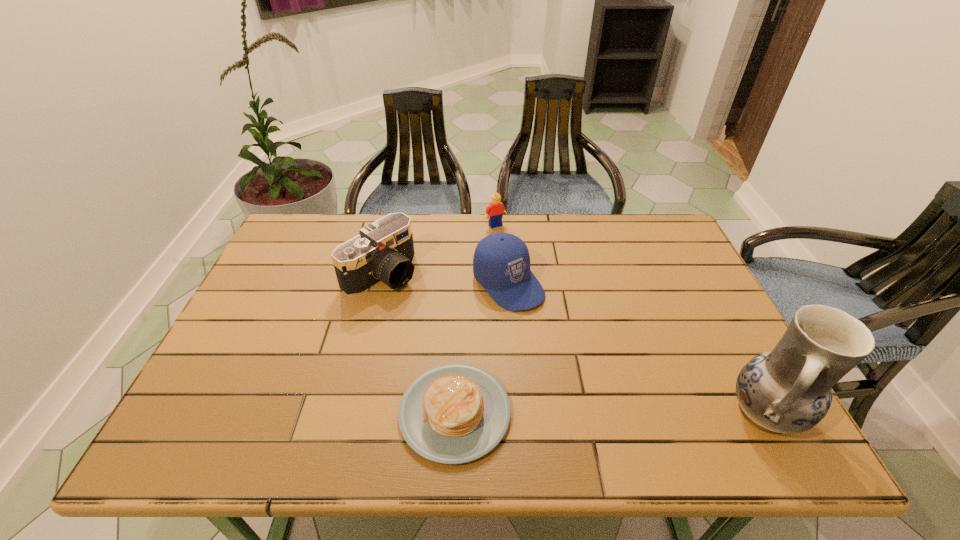
In the image, there is a desktop. At what (x,y) coordinates should I click in order to perform the action: click on free space at the far right corner. Please return your answer as a coordinate pair (x, y). Image resolution: width=960 pixels, height=540 pixels. Looking at the image, I should click on (670, 227).

You are a GUI agent. You are given a task and a screenshot of the screen. Output one action in this format:
    pyautogui.click(x=<x>, y=<y>)
    Task: Click on the vacant point located between the pottery and the farthest object
    
    Given the screenshot: What is the action you would take?
    pyautogui.click(x=631, y=320)

Identify the location of free space between the camera and the pancake. The image size is (960, 540). (x=419, y=342).

Where is `free space between the leftmost object and the pottery`? The width and height of the screenshot is (960, 540). free space between the leftmost object and the pottery is located at coordinates (574, 344).

Locate an element on the screen. The image size is (960, 540). free space between the pottery and the pancake is located at coordinates (611, 413).

At what (x,y) coordinates should I click in order to perform the action: click on free spot between the leftmost object and the Lego. Please return your answer as a coordinate pair (x, y). Looking at the image, I should click on (439, 249).

Where is `free space between the Lego and the pancake`? The height and width of the screenshot is (540, 960). free space between the Lego and the pancake is located at coordinates (475, 319).

Where is `free space that is in between the shortest object and the pottery`? This screenshot has height=540, width=960. free space that is in between the shortest object and the pottery is located at coordinates 611,413.

What are the coordinates of `free space between the cap and the leftmost object` in the screenshot? It's located at (445, 279).

Image resolution: width=960 pixels, height=540 pixels. What are the coordinates of `vacant space that's between the leftmost object and the farthest object` in the screenshot? It's located at (439, 249).